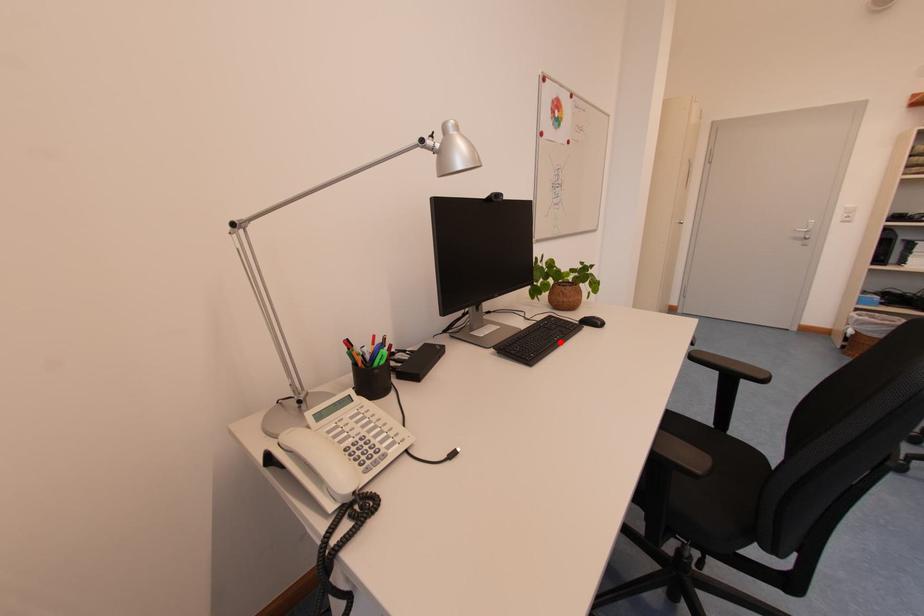
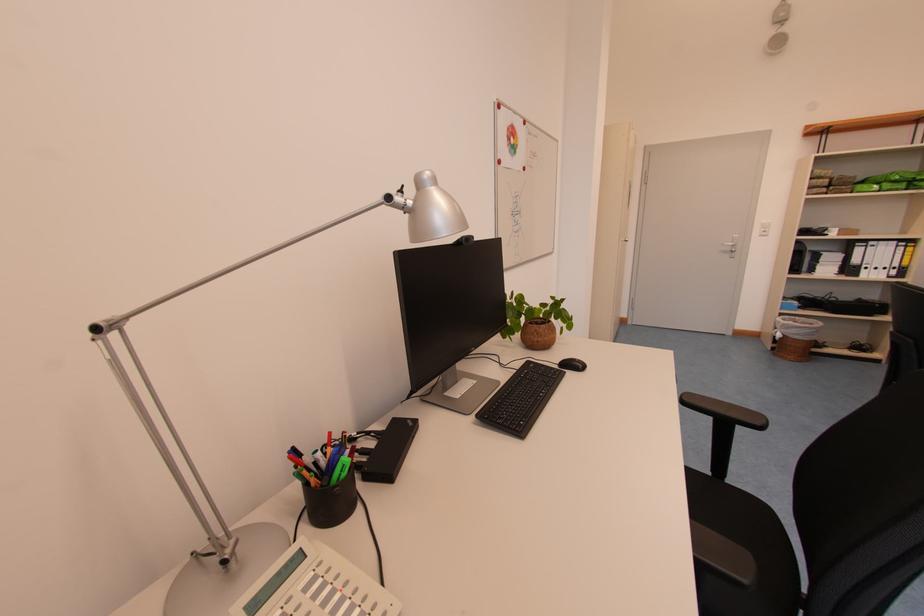
Find the pixel in the second image that matches the highlighted location in the first image.

(546, 398)